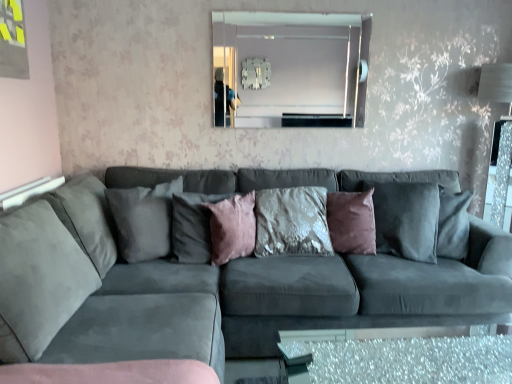
Question: Should I look upward or downward to see pink velvet cushion at center, the second pillow viewed from the right?

Choices:
 (A) up
 (B) down

Answer: (B)

Question: Is clear glass table at lower center smaller than velvet textured pillow at center, the fourth pillow positioned from the left?

Choices:
 (A) no
 (B) yes

Answer: (A)

Question: Considering the relative positions of clear glass table at lower center and velvet textured pillow at center, placed as the first pillow when sorted from right to left, in the image provided, is clear glass table at lower center to the left of velvet textured pillow at center, placed as the first pillow when sorted from right to left, from the viewer's perspective?

Choices:
 (A) no
 (B) yes

Answer: (A)

Question: Is clear glass table at lower center beside velvet textured pillow at center, the fourth pillow positioned from the left?

Choices:
 (A) no
 (B) yes

Answer: (A)

Question: Can you confirm if clear glass table at lower center is taller than velvet textured pillow at center, the fourth pillow positioned from the left?

Choices:
 (A) yes
 (B) no

Answer: (B)

Question: From the image's perspective, is clear glass table at lower center on top of velvet textured pillow at center, placed as the first pillow when sorted from right to left?

Choices:
 (A) no
 (B) yes

Answer: (A)

Question: Considering the relative sizes of clear glass table at lower center and velvet textured pillow at center, the fourth pillow positioned from the left, in the image provided, is clear glass table at lower center thinner than velvet textured pillow at center, the fourth pillow positioned from the left,?

Choices:
 (A) yes
 (B) no

Answer: (B)

Question: Is the depth of suede gray couch at center greater than that of clear glass table at lower center?

Choices:
 (A) yes
 (B) no

Answer: (B)

Question: Can you confirm if suede gray couch at center is shorter than clear glass table at lower center?

Choices:
 (A) no
 (B) yes

Answer: (A)

Question: From a real-world perspective, is suede gray couch at center physically below clear glass table at lower center?

Choices:
 (A) no
 (B) yes

Answer: (A)

Question: Does suede gray couch at center have a smaller size compared to clear glass table at lower center?

Choices:
 (A) yes
 (B) no

Answer: (B)

Question: Is suede gray couch at center positioned beyond the bounds of clear glass table at lower center?

Choices:
 (A) yes
 (B) no

Answer: (A)

Question: Is suede gray couch at center taller than clear glass table at lower center?

Choices:
 (A) no
 (B) yes

Answer: (B)

Question: Is clear glass mirror at upper center not inside velvet textured pillow at center, placed as the first pillow when sorted from right to left?

Choices:
 (A) yes
 (B) no

Answer: (A)